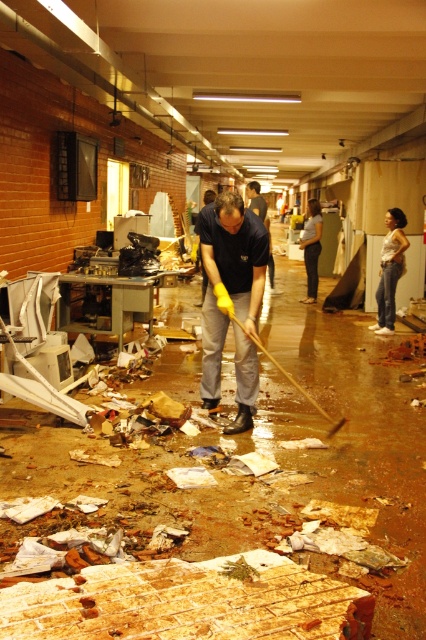
Between point (382, 314) and point (310, 268), which one is positioned behind?

Point (310, 268)

In the scene shown: Is white cotton shirt at center thinner than light brown hair at center?

No, white cotton shirt at center is not thinner than light brown hair at center.

Does point (379, 273) lie in front of point (316, 237)?

Yes, point (379, 273) is closer to viewer.

The image size is (426, 640). What are the coordinates of `white cotton shirt at center` in the screenshot? It's located at (389, 269).

Is matte blue shirt at center positioned in front of white cotton shirt at center?

That is True.

In the scene shown: Which of these two, matte blue shirt at center or white cotton shirt at center, stands shorter?

Standing shorter between the two is matte blue shirt at center.

Between point (218, 301) and point (388, 241), which one is positioned behind?

Point (388, 241)

Identify the location of matte blue shirt at center. Image resolution: width=426 pixels, height=640 pixels. (229, 280).

Who is more distant from viewer, (388, 269) or (221, 308)?

The point (388, 269) is more distant.

Does point (403, 268) come farther from viewer compared to point (330, 429)?

Yes.

Find the location of a particular element. white cotton shirt at center is located at coordinates (389, 269).

At what (x,y) coordinates should I click in order to perform the action: click on white cotton shirt at center. Please return your answer as a coordinate pair (x, y). This screenshot has width=426, height=640. Looking at the image, I should click on (389, 269).